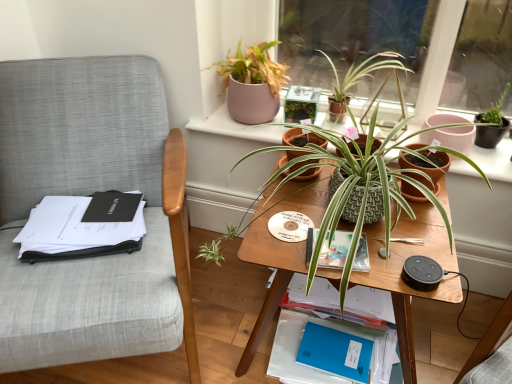
Locate an element on the screen. free space that is to the left of blue matte paperback book at lower center, which ranks as the 2th paperback book in top-to-bottom order is located at coordinates (293, 349).